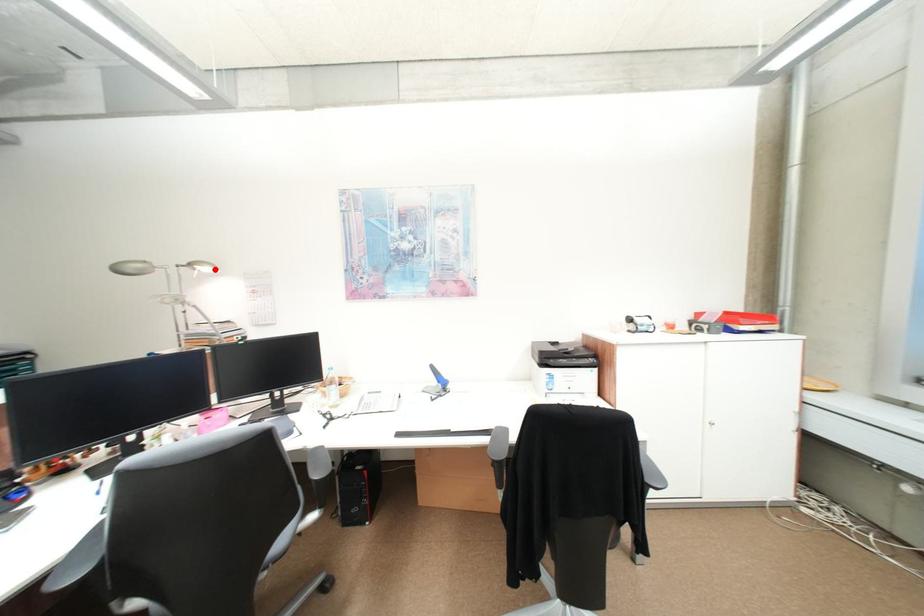
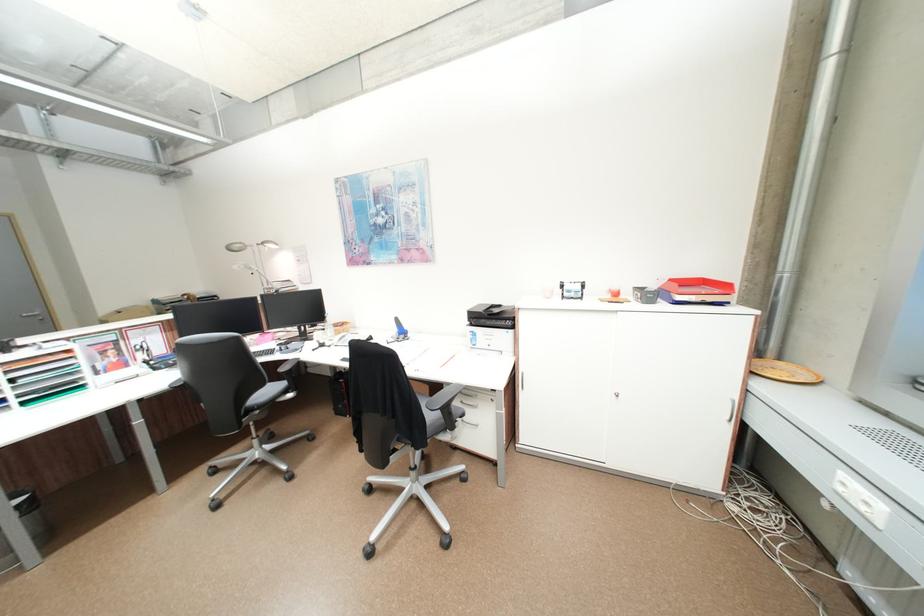
Question: I am providing you with two images of the same scene from different viewpoints. In image1, a red point is highlighted. Considering the same 3D point in image2, which of the following is correct?

Choices:
 (A) It is closer
 (B) It is farther

Answer: (A)